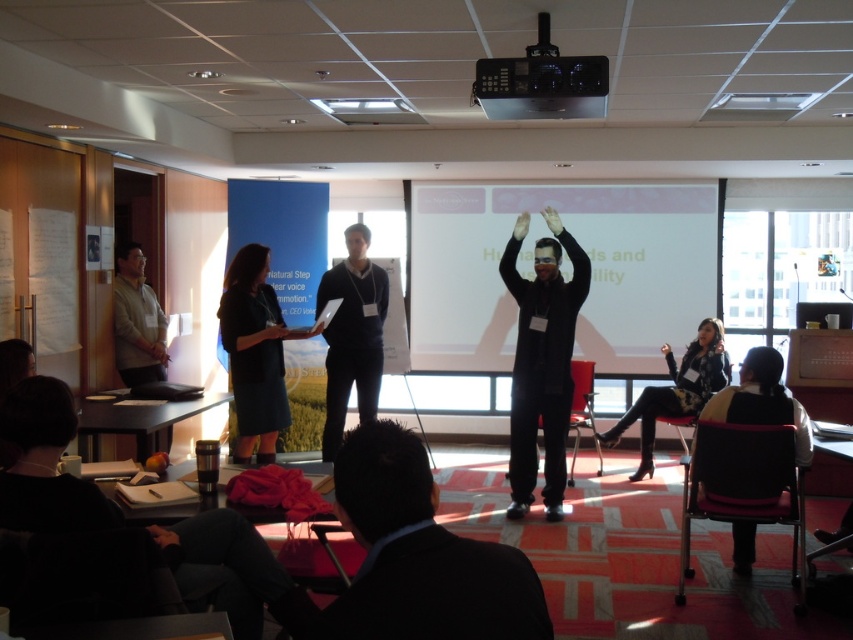
Does dark blue dress at center have a lesser height compared to velvet-like black chair at lower right?

No.

Is dark blue dress at center smaller than velvet-like black chair at lower right?

No.

Where is `dark blue dress at center`? dark blue dress at center is located at coordinates (254, 353).

Measure the distance between point (531, 232) and camera.

Point (531, 232) and camera are 7.14 meters apart from each other.

Which is more to the left, white matte projection screen at center or velvet-like black chair at lower right?

white matte projection screen at center is more to the left.

Identify the location of white matte projection screen at center. The height and width of the screenshot is (640, 853). (532, 273).

Locate an element on the screen. black plastic projector at upper center is located at coordinates (541, 86).

Which is below, black plastic projector at upper center or floral-patterned dress at center?

Positioned lower is floral-patterned dress at center.

I want to click on black plastic projector at upper center, so click(x=541, y=86).

Locate an element on the screen. Image resolution: width=853 pixels, height=640 pixels. black plastic projector at upper center is located at coordinates (541, 86).